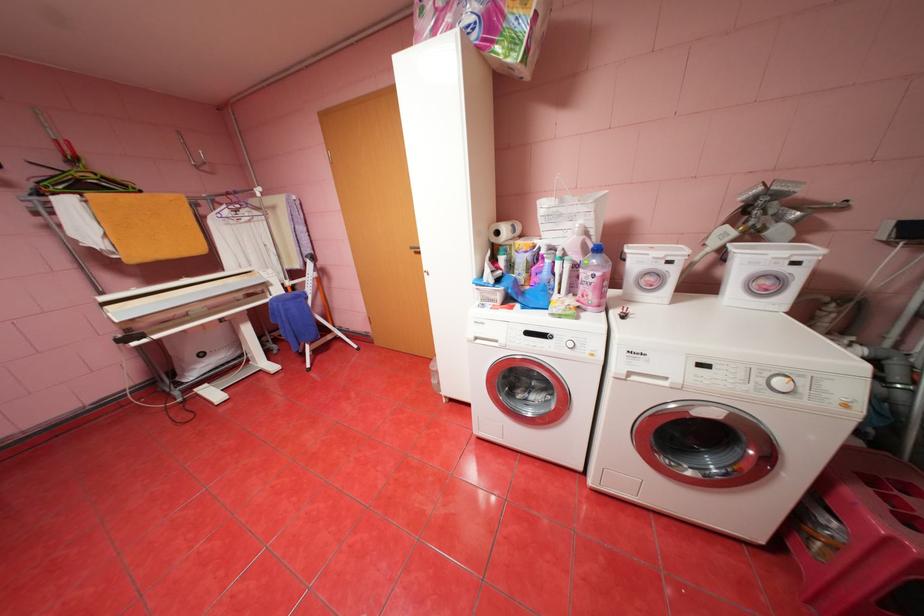
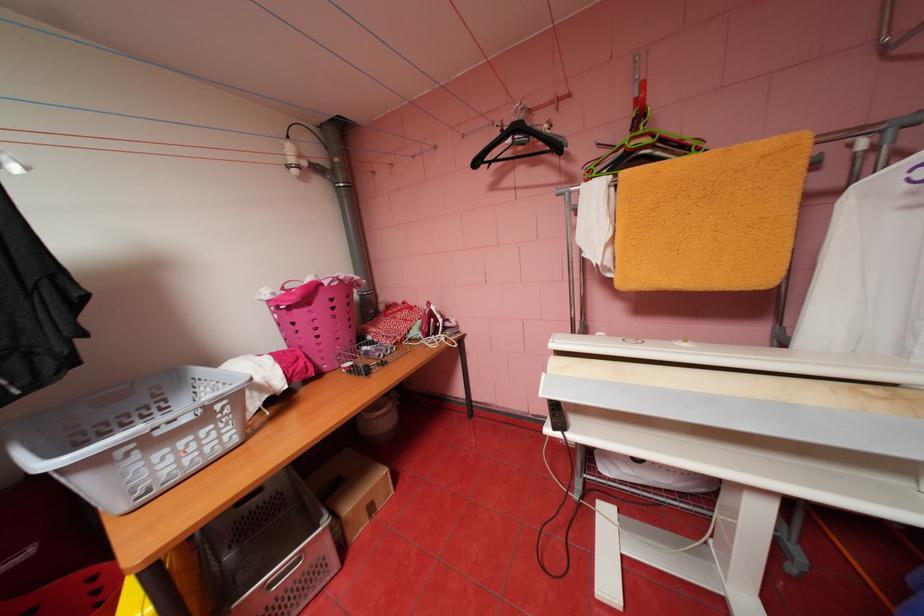
Find the pixel in the second image that matches point 100,176 in the first image.

(655, 140)